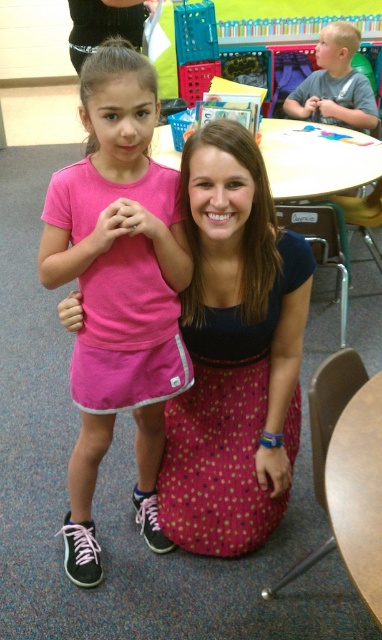
Does blonde hair boy at upper right have a greater height compared to black hair at upper left?

No.

Can you confirm if blonde hair boy at upper right is positioned to the left of black hair at upper left?

No, blonde hair boy at upper right is not to the left of black hair at upper left.

Between point (310, 77) and point (92, 3), which one is positioned in front?

Positioned in front is point (92, 3).

The width and height of the screenshot is (382, 640). In order to click on blonde hair boy at upper right in this screenshot , I will do `click(335, 83)`.

Who is shorter, pink fabric skirt at center or black hair at upper left?

black hair at upper left

Find the location of a particular element. pink fabric skirt at center is located at coordinates (118, 289).

Identify the location of pink fabric skirt at center. The width and height of the screenshot is (382, 640). (118, 289).

Does pink dotted fabric dress at center have a lesser width compared to black hair at upper left?

In fact, pink dotted fabric dress at center might be wider than black hair at upper left.

At what (x,y) coordinates should I click in order to perform the action: click on pink dotted fabric dress at center. Please return your answer as a coordinate pair (x, y). Image resolution: width=382 pixels, height=640 pixels. Looking at the image, I should click on (226, 422).

At what (x,y) coordinates should I click in order to perform the action: click on pink dotted fabric dress at center. Please return your answer as a coordinate pair (x, y). The width and height of the screenshot is (382, 640). Looking at the image, I should click on (226, 422).